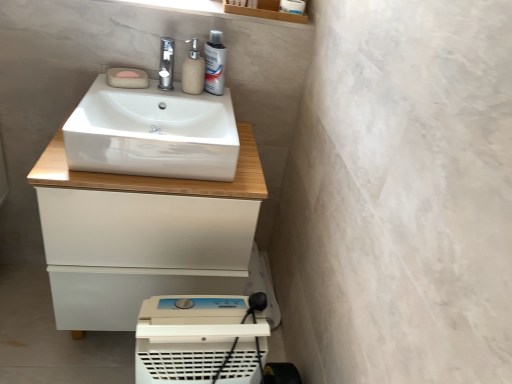
Question: Is white glossy cabinet at center taller than white plastic air purifier at lower center?

Choices:
 (A) yes
 (B) no

Answer: (A)

Question: Can you confirm if white glossy cabinet at center is shorter than white plastic air purifier at lower center?

Choices:
 (A) yes
 (B) no

Answer: (B)

Question: Does white glossy cabinet at center lie behind white plastic air purifier at lower center?

Choices:
 (A) yes
 (B) no

Answer: (A)

Question: Is white glossy cabinet at center to the left of white plastic air purifier at lower center from the viewer's perspective?

Choices:
 (A) no
 (B) yes

Answer: (B)

Question: Does white glossy cabinet at center have a greater width compared to white plastic air purifier at lower center?

Choices:
 (A) no
 (B) yes

Answer: (B)

Question: Can you confirm if white glossy cabinet at center is smaller than white plastic air purifier at lower center?

Choices:
 (A) no
 (B) yes

Answer: (A)

Question: Is pink felt soap at upper left, the first soap in the bottom-to-top sequence, at the right side of white glossy sink at center?

Choices:
 (A) yes
 (B) no

Answer: (B)

Question: From a real-world perspective, is pink felt soap at upper left, which is the 2th soap in top-to-bottom order, under white glossy sink at center?

Choices:
 (A) yes
 (B) no

Answer: (B)

Question: Is pink felt soap at upper left, the first soap in the bottom-to-top sequence, completely or partially outside of white glossy sink at center?

Choices:
 (A) yes
 (B) no

Answer: (B)

Question: Does pink felt soap at upper left, the first soap in the bottom-to-top sequence, come behind white glossy sink at center?

Choices:
 (A) no
 (B) yes

Answer: (B)

Question: Is white glossy sink at center at the back of pink felt soap at upper left, which is the 2th soap in top-to-bottom order?

Choices:
 (A) yes
 (B) no

Answer: (A)

Question: Is white glossy sink at center inside pink felt soap at upper left, the first soap in the bottom-to-top sequence?

Choices:
 (A) yes
 (B) no

Answer: (B)

Question: Considering the relative sizes of satin nickel faucet at upper center and white glossy sink at center in the image provided, is satin nickel faucet at upper center shorter than white glossy sink at center?

Choices:
 (A) no
 (B) yes

Answer: (B)